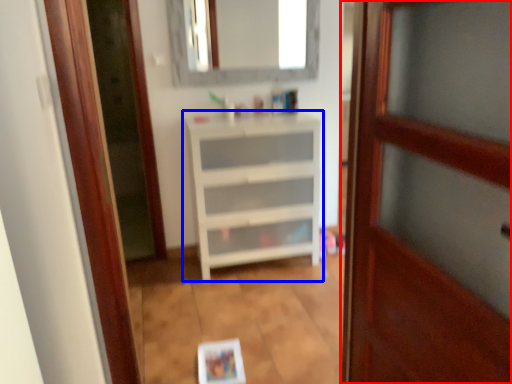
Question: Which object is closer to the camera taking this photo, door (highlighted by a red box) or chest of drawers (highlighted by a blue box)?

Choices:
 (A) door
 (B) chest of drawers

Answer: (A)